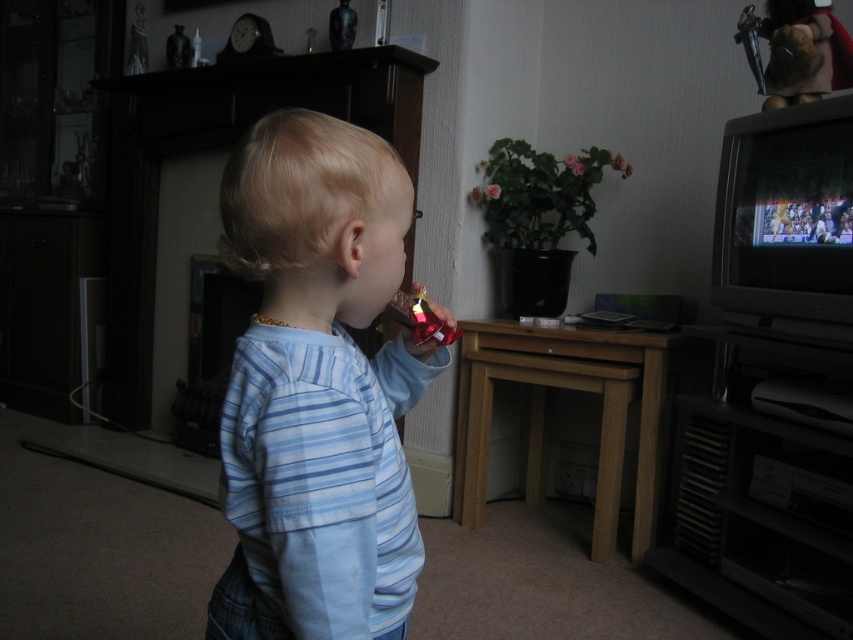
Question: Does blue striped shirt at center appear over metallic gray television at right?

Choices:
 (A) yes
 (B) no

Answer: (A)

Question: Is blue striped shirt at center thinner than metallic gray television at right?

Choices:
 (A) no
 (B) yes

Answer: (B)

Question: Is blue striped shirt at center bigger than metallic gray television at right?

Choices:
 (A) no
 (B) yes

Answer: (A)

Question: Which of the following is the closest to the observer?

Choices:
 (A) (802, 472)
 (B) (350, 157)

Answer: (B)

Question: Which point appears closest to the camera in this image?

Choices:
 (A) (805, 512)
 (B) (344, 566)

Answer: (B)